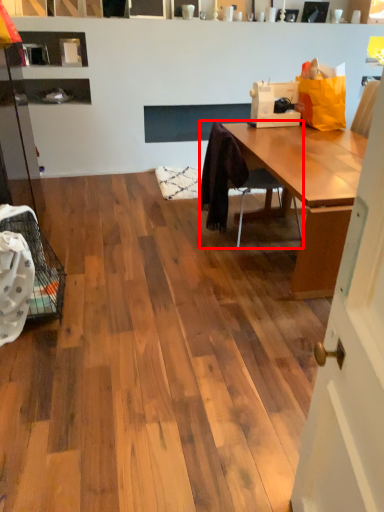
Question: Considering the relative positions of chair (annotated by the red box) and sewing machine in the image provided, where is chair (annotated by the red box) located with respect to the staircase?

Choices:
 (A) left
 (B) right

Answer: (A)